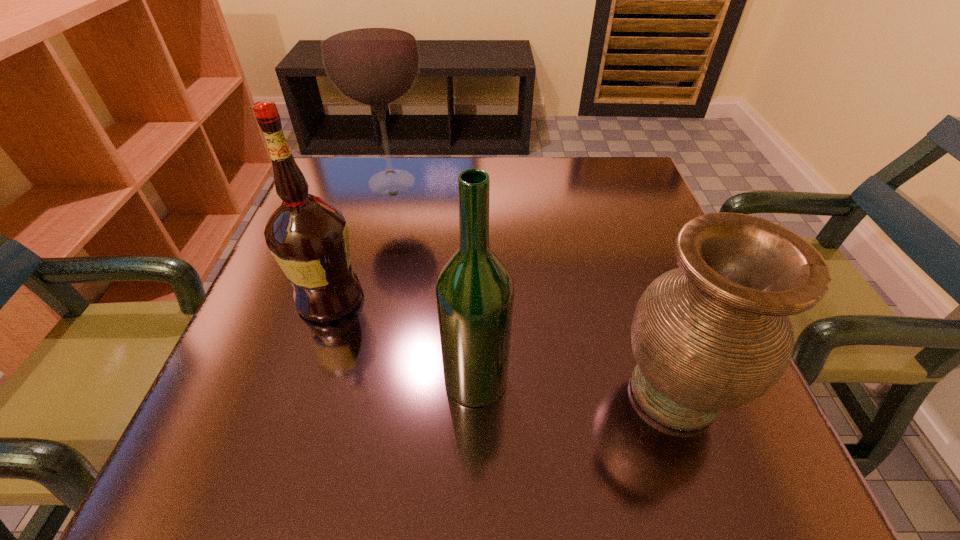
The width and height of the screenshot is (960, 540). Find the location of `object that is at the far edge`. object that is at the far edge is located at coordinates (370, 53).

You are a GUI agent. You are given a task and a screenshot of the screen. Output one action in this format:
    pyautogui.click(x=<x>, y=<y>)
    Task: Click on the object positioned at the near edge
    The width and height of the screenshot is (960, 540).
    Given the screenshot: What is the action you would take?
    click(x=714, y=334)

Locate an element on the screen. object situated at the right edge is located at coordinates [714, 334].

You are a GUI agent. You are given a task and a screenshot of the screen. Output one action in this format:
    pyautogui.click(x=<x>, y=<y>)
    Task: Click on the object that is at the far left corner
    
    Given the screenshot: What is the action you would take?
    pyautogui.click(x=370, y=53)

At what (x,y) coordinates should I click in order to perform the action: click on object that is at the near right corner. Please return your answer as a coordinate pair (x, y). Looking at the image, I should click on (714, 334).

Where is `free point at the far edge`? The image size is (960, 540). free point at the far edge is located at coordinates (556, 166).

Where is `free region at the near edge of the desktop`? This screenshot has height=540, width=960. free region at the near edge of the desktop is located at coordinates (535, 461).

In the image, there is a desktop. At what (x,y) coordinates should I click in order to perform the action: click on vacant space at the left edge. Please return your answer as a coordinate pair (x, y). Looking at the image, I should click on (266, 353).

In order to click on vacant space at the right edge of the desktop in this screenshot , I will do `click(629, 341)`.

Locate an element on the screen. vacant region at the far left corner is located at coordinates (364, 190).